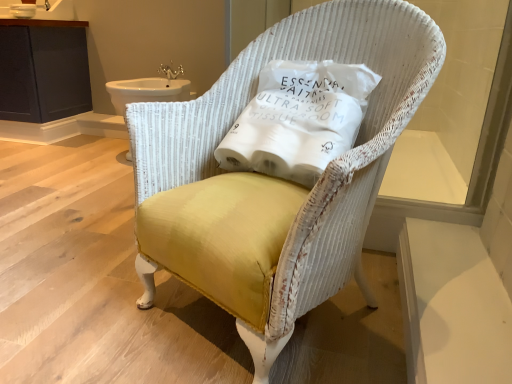
Identify the location of vacant region below yellow fabric chair at center (from a real-world perspective). (305, 316).